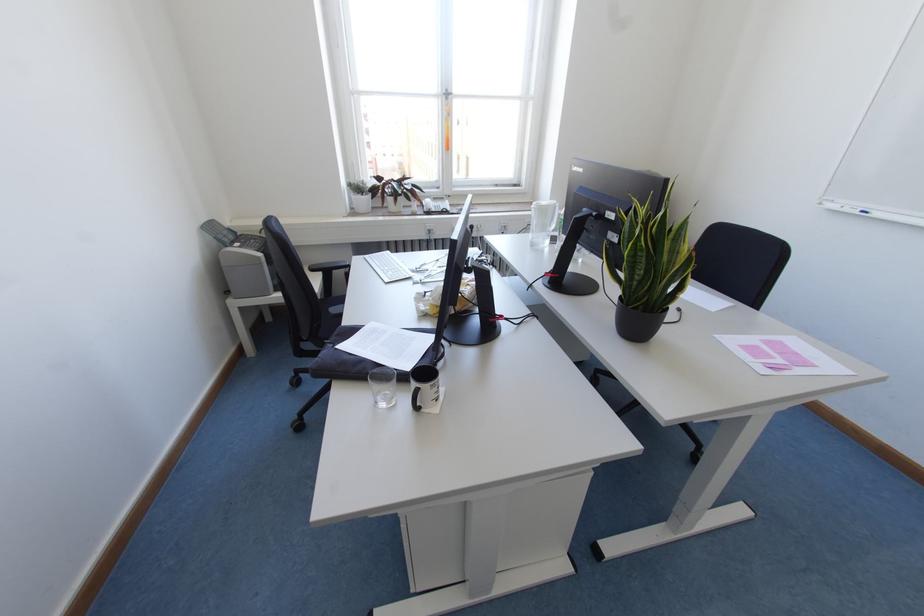
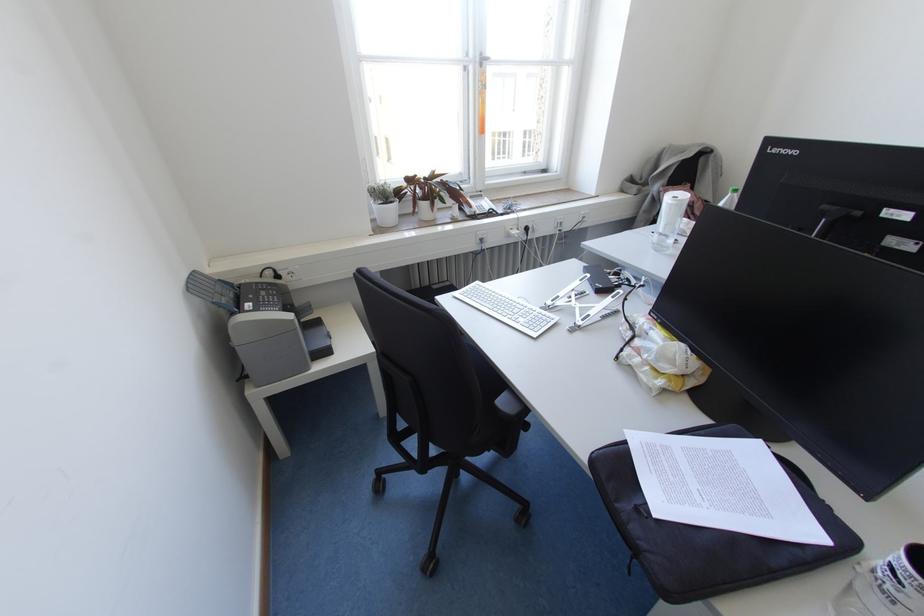
Locate, in the second image, the point that corresponds to [446,98] in the first image.

(480, 65)